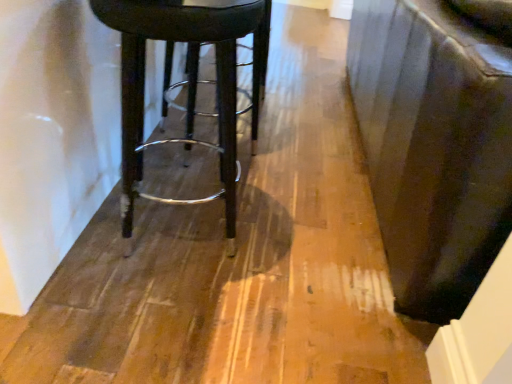
Image resolution: width=512 pixels, height=384 pixels. Find the location of `matte black stool at center`. matte black stool at center is located at coordinates point(216,82).

The image size is (512, 384). Describe the element at coordinates (216, 82) in the screenshot. I see `matte black stool at center` at that location.

Find the location of a particular element. matte black stool at center is located at coordinates (216, 82).